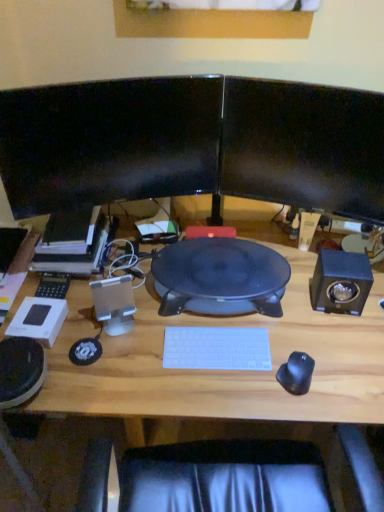
Find the location of a particular element. vacant space situated on the left part of satin black speaker at right, which ranks as the 1th speaker in right-to-left order is located at coordinates (287, 309).